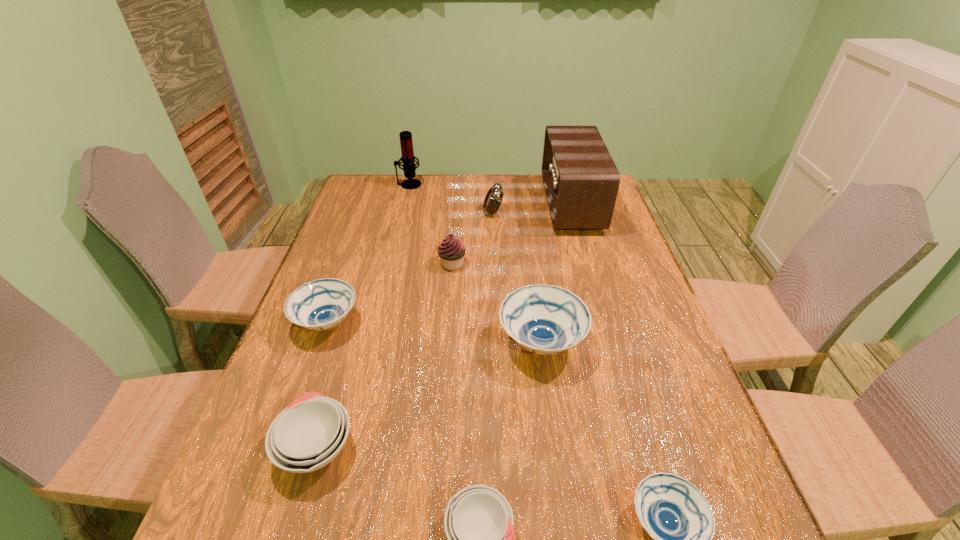
Locate an element on the screen. free region at the right edge of the desktop is located at coordinates (660, 429).

Where is `vacant space at the far left corner of the desktop`? Image resolution: width=960 pixels, height=540 pixels. vacant space at the far left corner of the desktop is located at coordinates (366, 174).

Locate an element on the screen. The width and height of the screenshot is (960, 540). free spot between the farther white soup bowl and the microphone is located at coordinates (363, 315).

Find the location of a particular element. The height and width of the screenshot is (540, 960). free point between the pink cupcake and the white alarm clock is located at coordinates (472, 238).

Find the location of a particular element. free area in between the white alarm clock and the radio receiver is located at coordinates (532, 208).

The height and width of the screenshot is (540, 960). In order to click on free point between the cupcake and the tallest soup bowl in this screenshot , I will do `click(497, 303)`.

I want to click on free space between the radio receiver and the biggest blue soup bowl, so click(x=556, y=273).

The height and width of the screenshot is (540, 960). I want to click on vacant area between the red microphone and the farther white soup bowl, so click(363, 315).

Find the location of a particular element. object that is the sixth nearest to the red microphone is located at coordinates (307, 435).

Identify the location of the eighth closest object relative to the alarm clock. This screenshot has width=960, height=540. (478, 521).